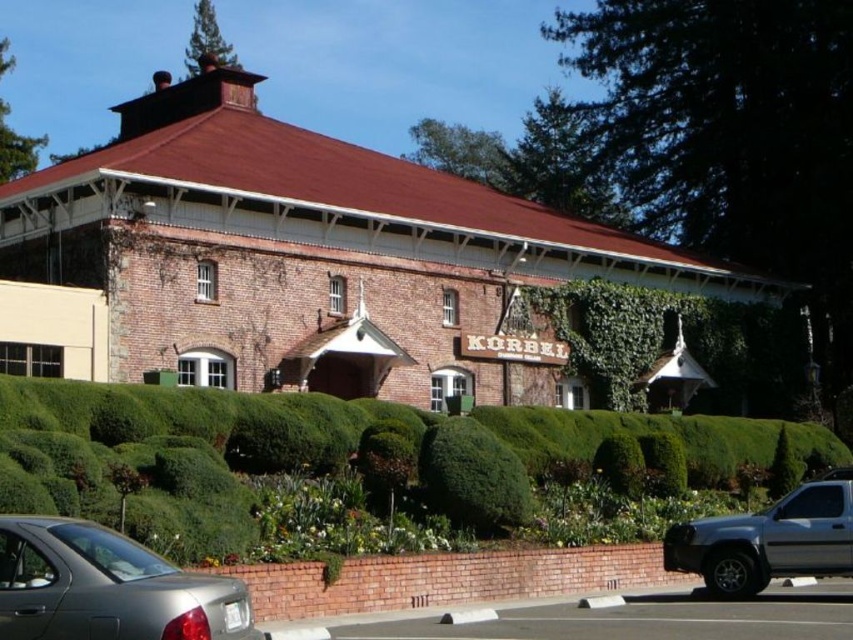
Who is taller, green leafy hedge at center or satin silver sedan at lower left?

green leafy hedge at center

Between green leafy hedge at center and satin silver sedan at lower left, which one is positioned lower?

satin silver sedan at lower left

Between point (461, 470) and point (96, 618), which one is positioned behind?

Positioned behind is point (461, 470).

The height and width of the screenshot is (640, 853). What are the coordinates of `green leafy hedge at center` in the screenshot? It's located at (373, 468).

Is point (111, 616) farther from camera compared to point (785, 500)?

No.

Can you confirm if satin silver sedan at lower left is positioned below silver metallic truck at lower right?

Incorrect, satin silver sedan at lower left is not positioned below silver metallic truck at lower right.

The height and width of the screenshot is (640, 853). I want to click on satin silver sedan at lower left, so click(x=107, y=588).

Is point (495, 483) positioned in front of point (479, 520)?

Yes.

Is green leafy hedge at center above green leafy bush at center?

Yes.

Where is `green leafy hedge at center`? Image resolution: width=853 pixels, height=640 pixels. green leafy hedge at center is located at coordinates (373, 468).